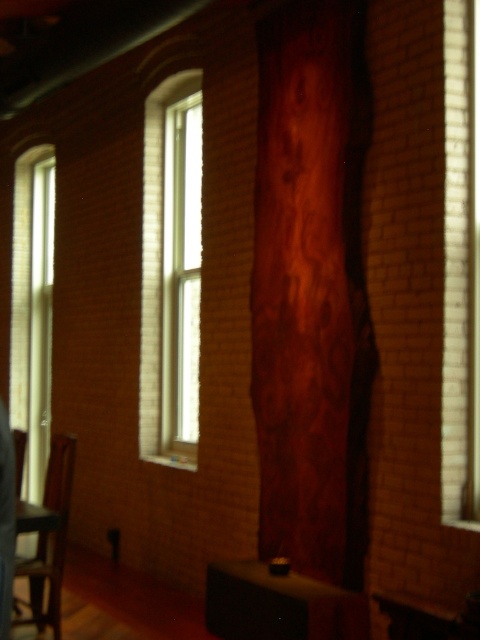
Question: Which object is closer to the camera taking this photo?

Choices:
 (A) clear glass window at right
 (B) wooden chair at left
 (C) shiny black phone at left

Answer: (C)

Question: Is clear glass window at right bigger than wooden chair at left?

Choices:
 (A) no
 (B) yes

Answer: (A)

Question: Can you confirm if white wood window at center is positioned to the right of wooden chair at left?

Choices:
 (A) yes
 (B) no

Answer: (A)

Question: Among these objects, which one is farthest from the camera?

Choices:
 (A) wooden chair at left
 (B) white wood window at center
 (C) clear glass window at left

Answer: (C)

Question: From the image, what is the correct spatial relationship of clear glass window at left in relation to wooden chair at left?

Choices:
 (A) below
 (B) above

Answer: (B)

Question: Considering the real-world distances, which object is farthest from the white wood window at center?

Choices:
 (A) wooden chair at left
 (B) shiny black phone at left

Answer: (B)